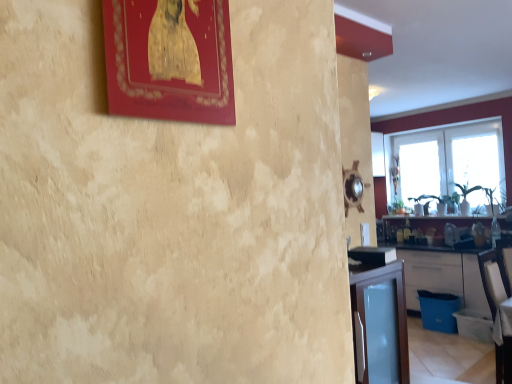
Question: Is white matte cabinet at lower right oriented away from transparent glass window at upper right, the first window when ordered from back to front?

Choices:
 (A) no
 (B) yes

Answer: (A)

Question: Are white matte cabinet at lower right and transparent glass window at upper right, arranged as the 2th window when viewed from the front, located far from each other?

Choices:
 (A) yes
 (B) no

Answer: (A)

Question: Is white matte cabinet at lower right surrounding transparent glass window at upper right, the first window when ordered from back to front?

Choices:
 (A) no
 (B) yes

Answer: (A)

Question: Considering the relative positions of white matte cabinet at lower right and transparent glass window at upper right, arranged as the 2th window when viewed from the front, in the image provided, is white matte cabinet at lower right to the right of transparent glass window at upper right, arranged as the 2th window when viewed from the front, from the viewer's perspective?

Choices:
 (A) yes
 (B) no

Answer: (A)

Question: From a real-world perspective, is white matte cabinet at lower right positioned over transparent glass window at upper right, the first window when ordered from back to front, based on gravity?

Choices:
 (A) yes
 (B) no

Answer: (B)

Question: Is transparent glass window at upper right, the first window when ordered from back to front, wider or thinner than white matte cabinet at lower right?

Choices:
 (A) thin
 (B) wide

Answer: (A)

Question: Considering the positions of transparent glass window at upper right, the first window when ordered from back to front, and white matte cabinet at lower right in the image, is transparent glass window at upper right, the first window when ordered from back to front, bigger or smaller than white matte cabinet at lower right?

Choices:
 (A) small
 (B) big

Answer: (A)

Question: In terms of height, does transparent glass window at upper right, the first window when ordered from back to front, look taller or shorter compared to white matte cabinet at lower right?

Choices:
 (A) tall
 (B) short

Answer: (A)

Question: Choose the correct answer: Is transparent glass window at upper right, the first window when ordered from back to front, inside white matte cabinet at lower right or outside it?

Choices:
 (A) inside
 (B) outside

Answer: (B)

Question: From the image's perspective, relative to transparent glass window at right, positioned as the second window in back-to-front order, is white matte cabinet at lower right above or below?

Choices:
 (A) below
 (B) above

Answer: (A)

Question: In terms of size, does white matte cabinet at lower right appear bigger or smaller than transparent glass window at right, positioned as the second window in back-to-front order?

Choices:
 (A) big
 (B) small

Answer: (A)

Question: Does point (448, 289) appear closer or farther from the camera than point (381, 203)?

Choices:
 (A) farther
 (B) closer

Answer: (B)

Question: Is white matte cabinet at lower right wider or thinner than transparent glass window at right, positioned as the second window in back-to-front order?

Choices:
 (A) thin
 (B) wide

Answer: (B)

Question: Is transparent glass window at right situated inside transparent glass window at upper right, arranged as the 2th window when viewed from the front, or outside?

Choices:
 (A) inside
 (B) outside

Answer: (B)

Question: Would you say transparent glass window at right is to the left or to the right of transparent glass window at upper right, arranged as the 2th window when viewed from the front, in the picture?

Choices:
 (A) right
 (B) left

Answer: (A)